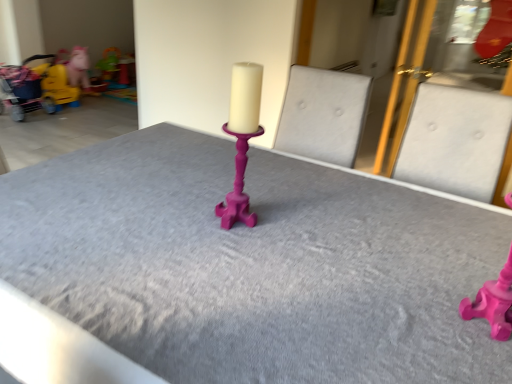
In order to click on free space to the left of matte pink candlestick at center, the 1th toy from the bottom in this screenshot , I will do `click(410, 315)`.